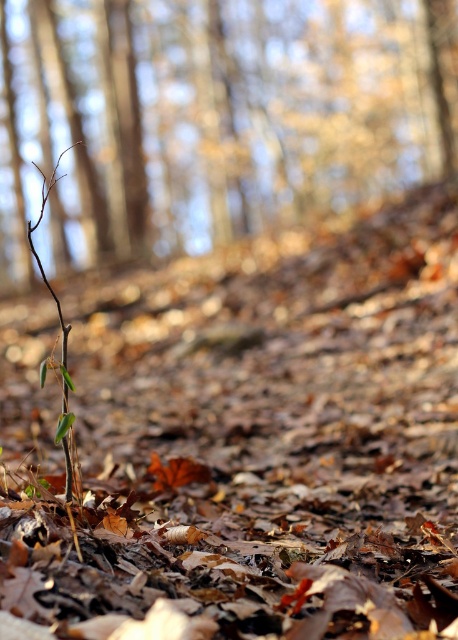
You are a photographer adjusting your camera settings to focus on two points in the forest scene. The first point is at coordinates point (15, 573) and the second is at point (94, 177). Based on the scene, which point should you focus on to ensure the closest object is sharp?

Point (15, 573) is closer to the camera than point (94, 177), so you should focus on point (15, 573) to ensure the closest object is sharp.

You are a photographer standing in the forest scene. You want to capture a photo where the brown matte branch at left is on the left side of the brown dry leaves at center. Is the current arrangement already set up that way?

Yes, the brown dry leaves at center is positioned on the right side of the brown matte branch at left, so the current arrangement already has the brown matte branch at left on the left side of the brown dry leaves at center.

You are a hiker who dropped your keys in the forest. You see the brown dry leaves at center and the brown matte branch at left. Which object is closer to the ground?

The brown dry leaves at center are closer to the ground because they are positioned under the brown matte branch at left.